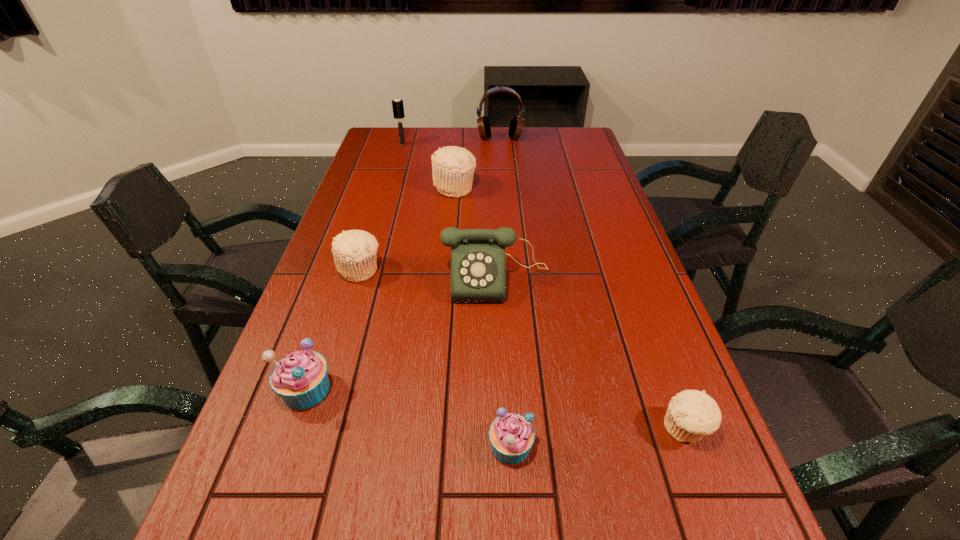
Locate an element on the screen. The height and width of the screenshot is (540, 960). muffin that is the fourth closest one to the third farthest object is located at coordinates (691, 414).

Identify which beige muffin is located as the third nearest to the hairbrush. Please provide its 2D coordinates. Your answer should be formatted as a tuple, i.e. [(x, y)], where the tuple contains the x and y coordinates of a point satisfying the conditions above.

[(691, 414)]

In order to click on the second closest beige muffin to the third muffin from left to right in this screenshot , I will do `click(691, 414)`.